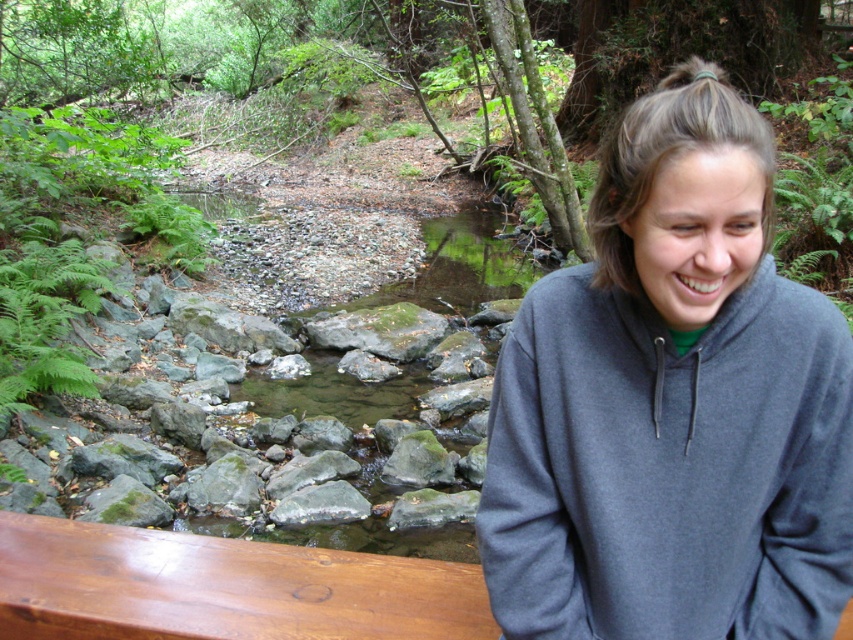
You are standing at the edge of the stream and see the gray fleece sweatshirt at center and the shiny brown wood at lower left. Which object is positioned closer to your right side?

The gray fleece sweatshirt at center is positioned to the right of the shiny brown wood at lower left, so it is closer to your right side.

You are planning to sit on the wooden bench near the stream. The gray fleece sweatshirt at center and the shiny brown wood at lower left are in your view. Which object is bigger in size?

The gray fleece sweatshirt at center is larger in size compared to the shiny brown wood at lower left.

You are standing at the edge of the stream and notice the gray fleece sweatshirt at center and the shiny brown wood at lower left. Which object is closer to you?

The gray fleece sweatshirt at center is closer to you because it is in front of the shiny brown wood at lower left.